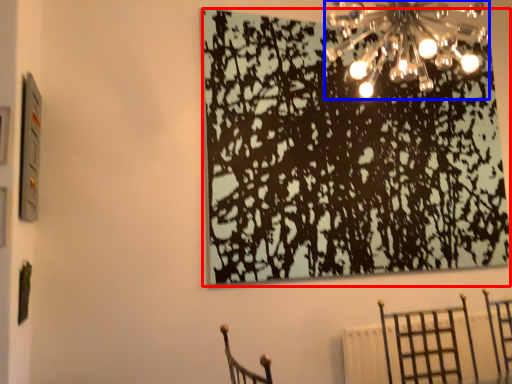
Question: Which of the following is the closest to the observer, tree (highlighted by a red box) or lamp (highlighted by a blue box)?

Choices:
 (A) tree
 (B) lamp

Answer: (B)